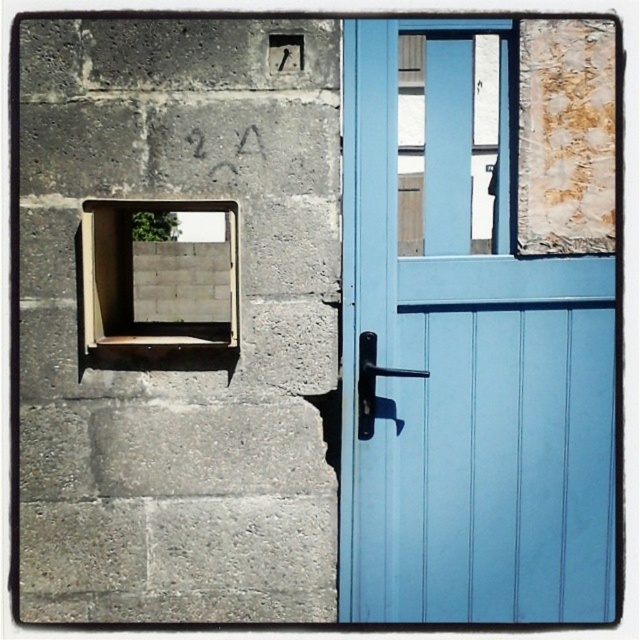
You are a painter who needs to know the relative sizes of the objects to estimate the amount of paint required. Based on the scene, which object requires more paint for its surface area, the light blue wooden door at center or the matte glass window at left?

The light blue wooden door at center requires more paint because it is much taller than the matte glass window at left, resulting in a larger surface area.

You are a delivery person trying to locate the entrance to the building. You see the matte glass window at left and the polished metal door handle at center. Which object is closer to you?

The matte glass window at left is in front of the polished metal door handle at center, so it is closer to you.